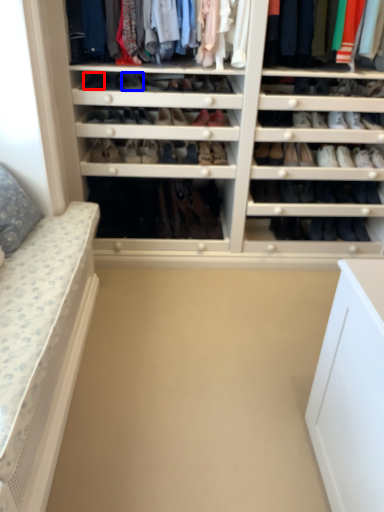
Question: Which point is further to the camera, shoe (highlighted by a red box) or shoe (highlighted by a blue box)?

Choices:
 (A) shoe
 (B) shoe

Answer: (B)